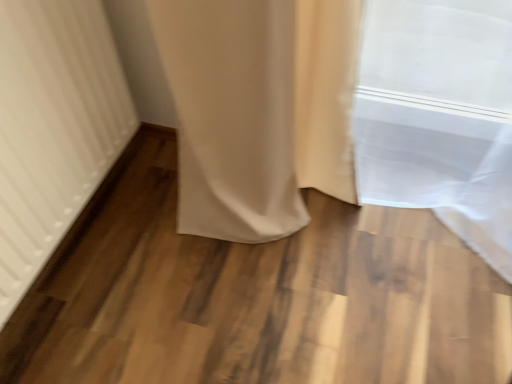
Find the location of a particular element. Image resolution: width=512 pixels, height=384 pixels. beige fabric curtain at left is located at coordinates (53, 127).

Measure the distance between point (68,41) and camera.

The depth of point (68,41) is 34.69 inches.

The height and width of the screenshot is (384, 512). What do you see at coordinates (53, 127) in the screenshot?
I see `beige fabric curtain at left` at bounding box center [53, 127].

This screenshot has height=384, width=512. What are the coordinates of `beige fabric curtain at left` in the screenshot? It's located at (53, 127).